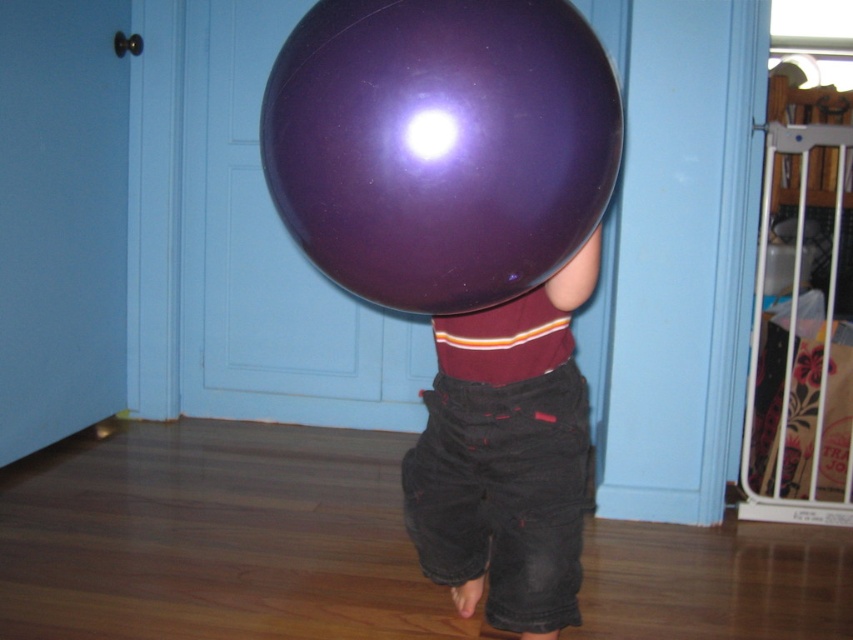
Does shiny purple balloon at center have a smaller size compared to denim shorts at center?

Yes.

Is shiny purple balloon at center positioned behind denim shorts at center?

That is False.

Measure the distance between point (x=579, y=209) and camera.

They are 83.38 centimeters apart.

Identify the location of shiny purple balloon at center. This screenshot has width=853, height=640. (440, 145).